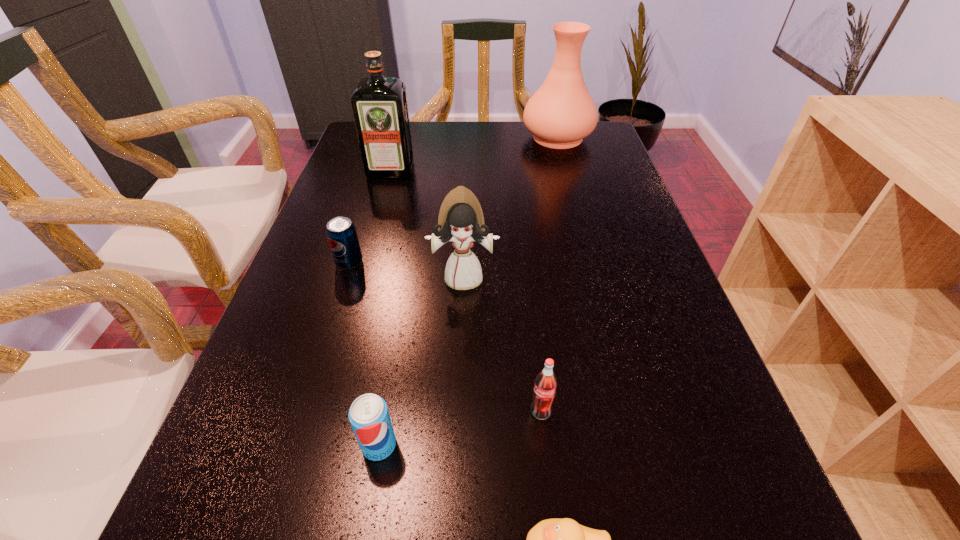
Where is `vacant space at the far edge`? This screenshot has width=960, height=540. vacant space at the far edge is located at coordinates (490, 137).

Identify the location of vacant space at the near edge of the desktop. (303, 535).

Identify the location of free location at the left edge of the desktop. This screenshot has width=960, height=540. (326, 208).

The width and height of the screenshot is (960, 540). What are the coordinates of `vacant space at the right edge of the desktop` in the screenshot? It's located at (645, 232).

Image resolution: width=960 pixels, height=540 pixels. I want to click on free area in between the fourth tallest object and the farthest object, so click(x=549, y=274).

Locate an element on the screen. The image size is (960, 540). unoccupied area between the rightmost soda can and the second farthest object is located at coordinates (466, 291).

Where is `vacant space in between the second farthest object and the farthest object`? This screenshot has height=540, width=960. vacant space in between the second farthest object and the farthest object is located at coordinates (474, 153).

Locate an element on the screen. unoccupied area between the fifth farthest object and the fourth object from right to left is located at coordinates (502, 345).

The width and height of the screenshot is (960, 540). Identify the location of empty location between the farthest object and the second farthest object. (474, 153).

The width and height of the screenshot is (960, 540). What are the coordinates of `unoccupied area between the nearest soda can and the vase` in the screenshot? It's located at (468, 291).